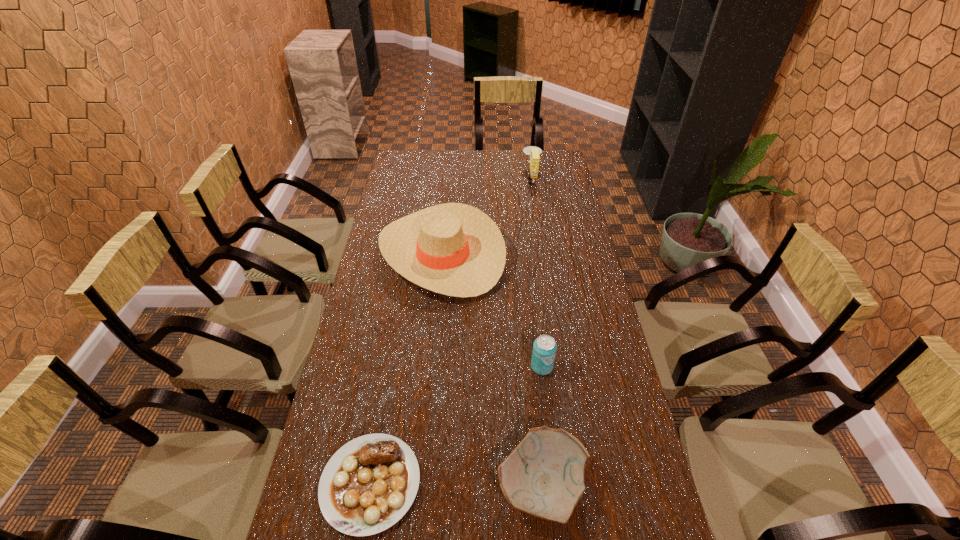
Where is `empty space between the farthest object and the second shortest object`? empty space between the farthest object and the second shortest object is located at coordinates (537, 332).

You are a GUI agent. You are given a task and a screenshot of the screen. Output one action in this format:
    pyautogui.click(x=<x>, y=<y>)
    Task: Click on the empty location between the steak and the second farthest object
    
    Given the screenshot: What is the action you would take?
    pyautogui.click(x=406, y=368)

You are a GUI agent. You are given a task and a screenshot of the screen. Output one action in this format:
    pyautogui.click(x=<x>, y=<y>)
    Task: Click on the object that is the nearest to the pottery
    This screenshot has height=540, width=960.
    Given the screenshot: What is the action you would take?
    pyautogui.click(x=368, y=485)

Select which object appears as the second closest to the shortest object. Please provide its 2D coordinates. Your answer should be formatted as a tuple, i.e. [(x, y)], where the tuple contains the x and y coordinates of a point satisfying the conditions above.

[(544, 351)]

This screenshot has width=960, height=540. In order to click on blank space that satisfies the following two spatial constraints: 1. on the front side of the second shortest object; 2. on the right side of the second farthest object in this screenshot , I will do `click(421, 485)`.

Locate an element on the screen. vacant space that satisfies the following two spatial constraints: 1. on the front side of the sunhat; 2. on the right side of the pottery is located at coordinates (421, 485).

Where is `blank area in the image that satisfies the following two spatial constraints: 1. on the front side of the sunhat; 2. on the left side of the second shortest object`? The height and width of the screenshot is (540, 960). blank area in the image that satisfies the following two spatial constraints: 1. on the front side of the sunhat; 2. on the left side of the second shortest object is located at coordinates (421, 485).

You are a GUI agent. You are given a task and a screenshot of the screen. Output one action in this format:
    pyautogui.click(x=<x>, y=<y>)
    Task: Click on the free spot that satisfies the following two spatial constraints: 1. on the front-facing side of the sponge; 2. on the front side of the steak
    The width and height of the screenshot is (960, 540).
    Given the screenshot: What is the action you would take?
    (581, 483)

Identify the location of free space in the image that satisfies the following two spatial constraints: 1. on the front-facing side of the farthest object; 2. on the front side of the second shortest object. pos(581,485).